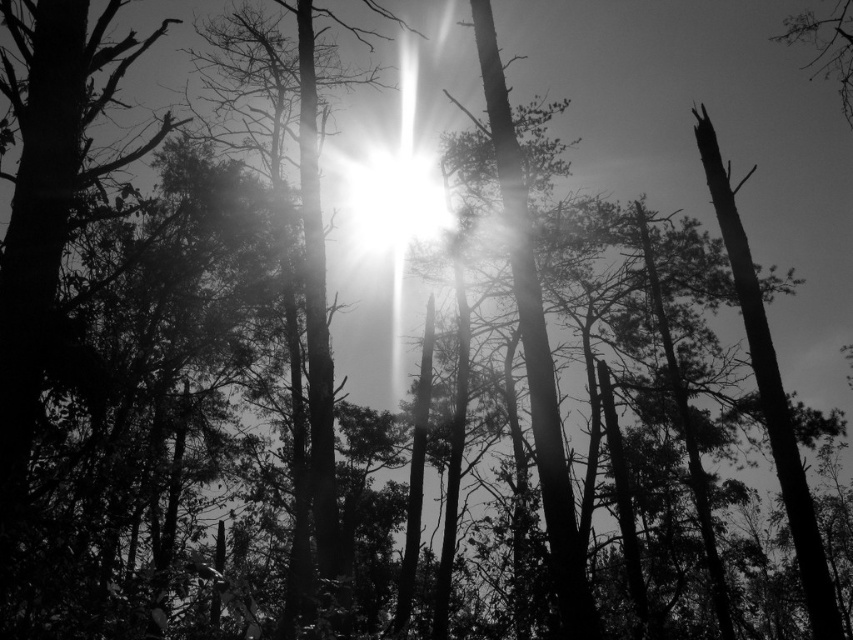
Does smooth dark wood tree trunk at right appear over bright white light at center?

Indeed, smooth dark wood tree trunk at right is positioned over bright white light at center.

Between point (770, 346) and point (428, 221), which one is positioned behind?

Positioned behind is point (428, 221).

The width and height of the screenshot is (853, 640). I want to click on smooth dark wood tree trunk at right, so click(x=770, y=392).

Is smooth dark wood tree trunk at right above smooth bark tree at upper right?

No, smooth dark wood tree trunk at right is not above smooth bark tree at upper right.

Can you confirm if smooth dark wood tree trunk at right is shorter than smooth bark tree at upper right?

In fact, smooth dark wood tree trunk at right may be taller than smooth bark tree at upper right.

Between point (750, 310) and point (840, 106), which one is positioned behind?

The point (840, 106) is behind.

Where is `smooth dark wood tree trunk at right`? This screenshot has height=640, width=853. smooth dark wood tree trunk at right is located at coordinates (770, 392).

Describe the element at coordinates (395, 198) in the screenshot. I see `bright white light at center` at that location.

Where is `bright white light at center`? This screenshot has width=853, height=640. bright white light at center is located at coordinates (395, 198).